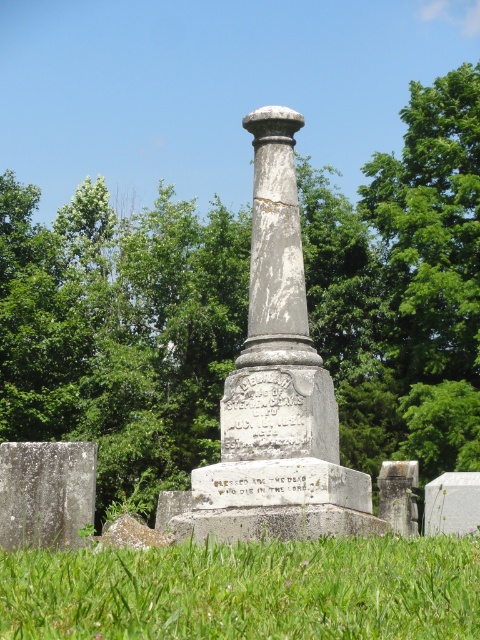
Measure the distance from gray stone column at center to white stone gravestone at lower left.

A distance of 10.05 meters exists between gray stone column at center and white stone gravestone at lower left.

Is point (333, 442) positioned before point (86, 509)?

No.

The image size is (480, 640). Identify the location of gray stone column at center. (276, 320).

Is green leafy tree at center below gray stone column at center?

No.

Does green leafy tree at center appear on the left side of gray stone column at center?

In fact, green leafy tree at center is to the right of gray stone column at center.

Which is behind, point (108, 243) or point (305, 387)?

The point (108, 243) is behind.

At what (x,y) coordinates should I click in order to perform the action: click on green leafy tree at center. Please return your answer as a coordinate pair (x, y). The height and width of the screenshot is (640, 480). Looking at the image, I should click on (120, 332).

Can you confirm if green leafy tree at center is positioned below green grass at lower center?

No, green leafy tree at center is not below green grass at lower center.

Is green leafy tree at center smaller than green grass at lower center?

Incorrect, green leafy tree at center is not smaller in size than green grass at lower center.

Is point (407, 445) less distant than point (181, 609)?

No.

The image size is (480, 640). What are the coordinates of `green leafy tree at center` in the screenshot? It's located at (120, 332).